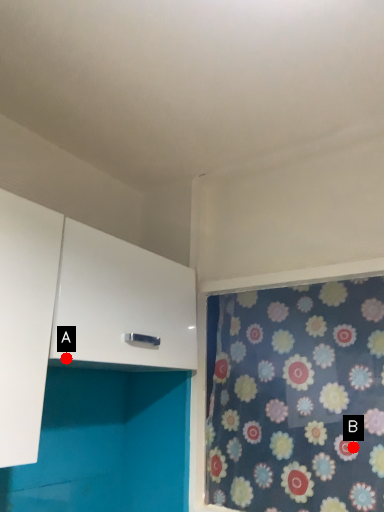
Question: Two points are circled on the image, labeled by A and B beside each circle. Which point is closer to the camera?

Choices:
 (A) A is closer
 (B) B is closer

Answer: (A)